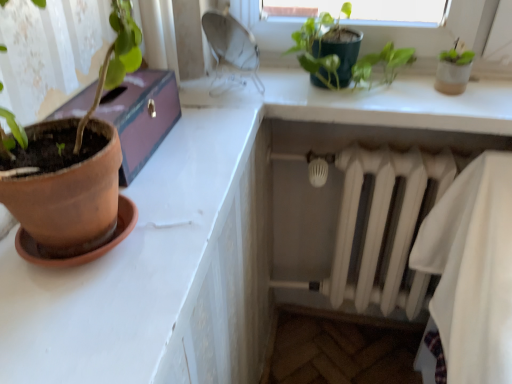
Question: Can we say terracotta clay pot at left lies outside white matte radiator at lower right?

Choices:
 (A) no
 (B) yes

Answer: (B)

Question: Is terracotta clay pot at left further to the viewer compared to white matte radiator at lower right?

Choices:
 (A) no
 (B) yes

Answer: (A)

Question: Does terracotta clay pot at left have a lesser height compared to white matte radiator at lower right?

Choices:
 (A) no
 (B) yes

Answer: (B)

Question: Is terracotta clay pot at left bigger than white matte radiator at lower right?

Choices:
 (A) no
 (B) yes

Answer: (A)

Question: From the image's perspective, is terracotta clay pot at left under white matte radiator at lower right?

Choices:
 (A) no
 (B) yes

Answer: (A)

Question: From a real-world perspective, is terracotta clay pot at left positioned over white matte radiator at lower right based on gravity?

Choices:
 (A) no
 (B) yes

Answer: (B)

Question: From the image's perspective, is terracotta clay pot at left located above terracotta clay pot at left?

Choices:
 (A) yes
 (B) no

Answer: (B)

Question: From a real-world perspective, is terracotta clay pot at left over terracotta clay pot at left?

Choices:
 (A) no
 (B) yes

Answer: (A)

Question: From a real-world perspective, is terracotta clay pot at left below terracotta clay pot at left?

Choices:
 (A) yes
 (B) no

Answer: (A)

Question: Does terracotta clay pot at left have a lesser width compared to terracotta clay pot at left?

Choices:
 (A) yes
 (B) no

Answer: (B)

Question: Does terracotta clay pot at left have a smaller size compared to terracotta clay pot at left?

Choices:
 (A) no
 (B) yes

Answer: (A)

Question: Does terracotta clay pot at left appear on the left side of terracotta clay pot at left?

Choices:
 (A) no
 (B) yes

Answer: (A)

Question: Does white matte radiator at lower right lie behind terracotta clay pot at left?

Choices:
 (A) no
 (B) yes

Answer: (B)